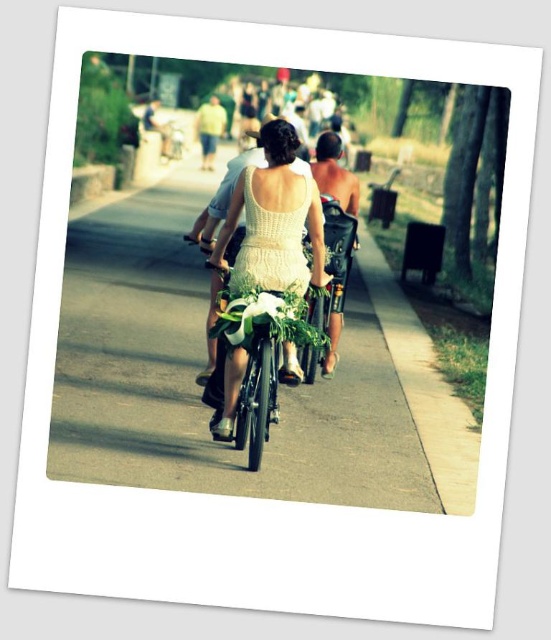
Question: Is smooth asphalt road at center to the left of smooth tan shirt at upper center from the viewer's perspective?

Choices:
 (A) yes
 (B) no

Answer: (B)

Question: From the image, what is the correct spatial relationship of light green fabric shirt at center in relation to smooth tan shirt at upper center?

Choices:
 (A) left
 (B) right

Answer: (B)

Question: Is smooth asphalt road at center to the left of shiny metallic helmet at center from the viewer's perspective?

Choices:
 (A) no
 (B) yes

Answer: (B)

Question: Which point is closer to the camera taking this photo?

Choices:
 (A) 331,323
 (B) 214,147
 (C) 102,410
 (D) 318,228

Answer: (D)

Question: Considering the real-world distances, which object is closest to the shiny metallic helmet at center?

Choices:
 (A) smooth tan shirt at upper center
 (B) white lace dress at center
 (C) light green fabric shirt at center

Answer: (B)

Question: Which point is farther to the camera?

Choices:
 (A) (212, 97)
 (B) (163, 136)

Answer: (A)